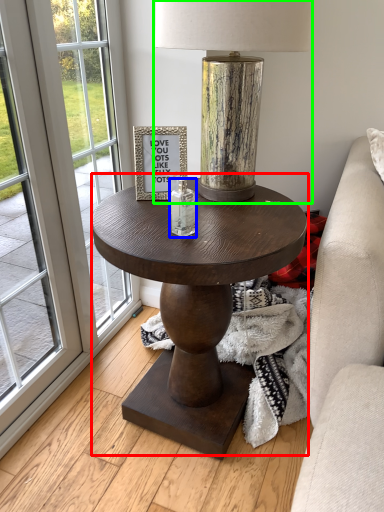
Question: Based on their relative distances, which object is nearer to coffee table (highlighted by a red box)? Choose from candle holder (highlighted by a blue box) and lamp (highlighted by a green box).

Choices:
 (A) candle holder
 (B) lamp

Answer: (A)